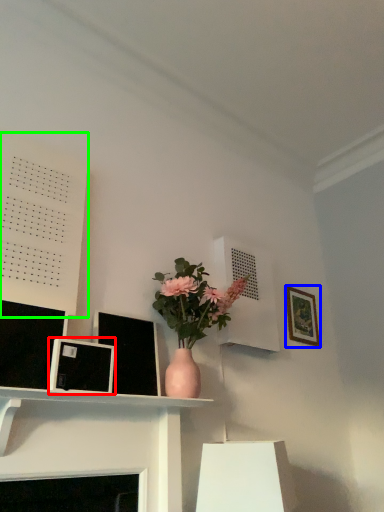
Question: Based on their relative distances, which object is farther from picture frame (highlighted by a red box)? Choose from picture frame (highlighted by a blue box) and bulletin board (highlighted by a green box).

Choices:
 (A) picture frame
 (B) bulletin board

Answer: (A)